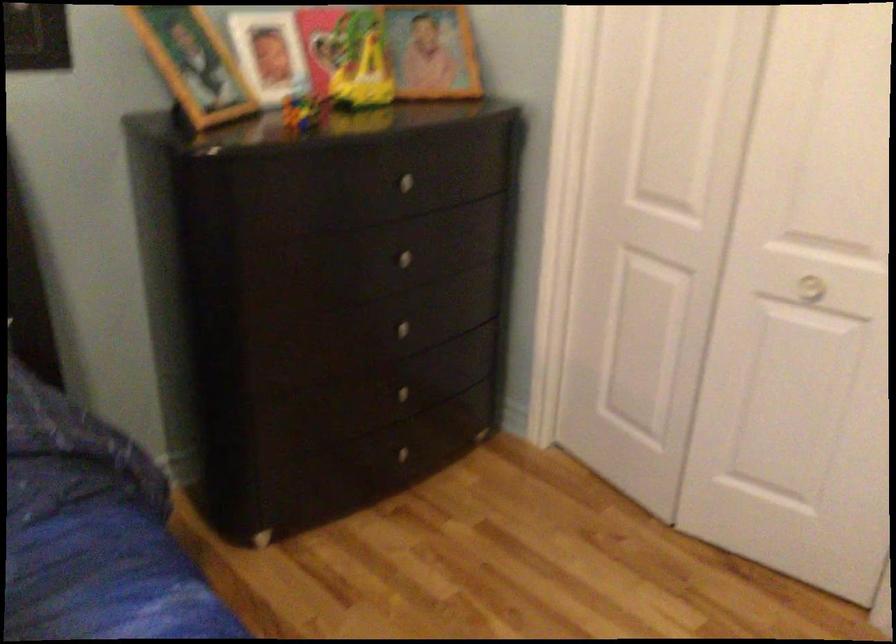
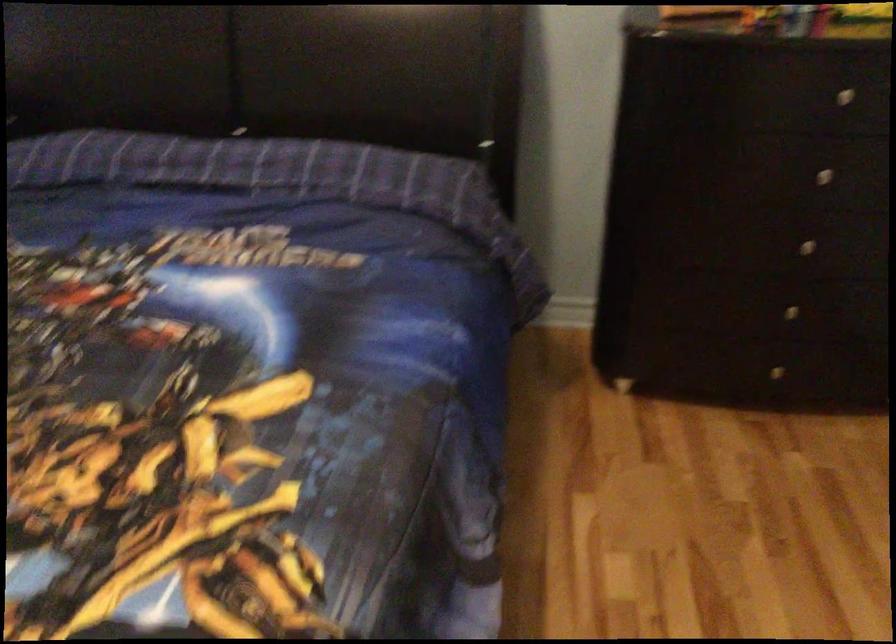
The point at (411, 251) is marked in the first image. Where is the corresponding point in the second image?

(833, 169)